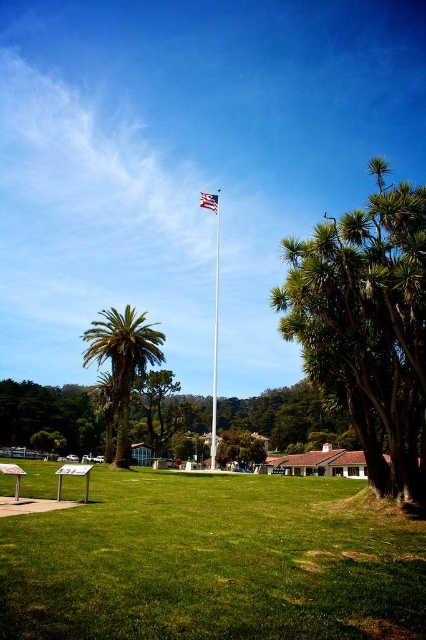
Question: Is green leafy tree at right above brown wooden picnic table at center?

Choices:
 (A) yes
 (B) no

Answer: (A)

Question: Can you confirm if green leafy tree at right is positioned above american flag at center?

Choices:
 (A) no
 (B) yes

Answer: (A)

Question: Is green leafy tree at right below wooden picnic table at lower left?

Choices:
 (A) no
 (B) yes

Answer: (A)

Question: Which of the following is the farthest from the observer?

Choices:
 (A) green leafy tree at right
 (B) american flag at center
 (C) wooden picnic table at lower left

Answer: (B)

Question: Which point is farther to the camera?

Choices:
 (A) (65, 464)
 (B) (17, 481)

Answer: (A)

Question: Which of the following is the closest to the observer?

Choices:
 (A) (17, 493)
 (B) (216, 276)
 (C) (106, 352)

Answer: (A)